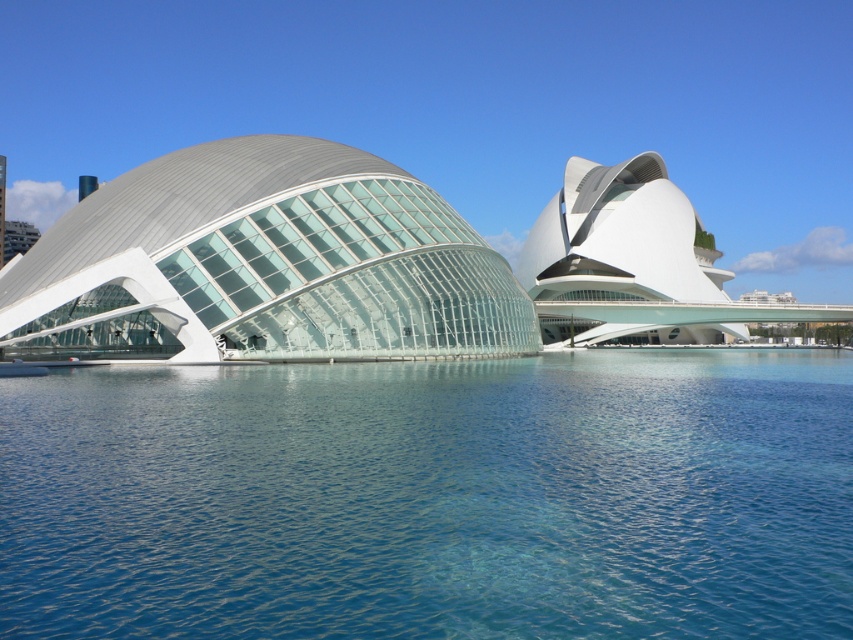
You are standing in front of the transparent glass dome at left and want to reach the transparent blue water at center. Which direction should you move to get there?

You should move to the right because the transparent blue water at center is located to the right of the transparent glass dome at left.

Based on the photo, you are a drone operator planning to fly a drone from the transparent glass dome at left to the transparent blue water at center. The drone has a maximum flight range of 14 meters. Can it reach the water without needing to recharge?

The distance between the transparent glass dome at left and the transparent blue water at center is 14.15 meters. Since the drone can only fly 14 meters before needing to recharge, it cannot reach the water without recharging.